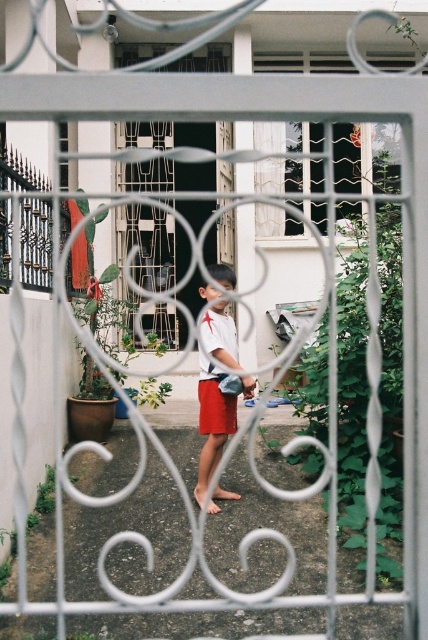
Question: Can you confirm if white matte shirt at center is thinner than red cotton shorts at center?

Choices:
 (A) no
 (B) yes

Answer: (A)

Question: From the image, what is the correct spatial relationship of white matte shirt at center in relation to red cotton shorts at center?

Choices:
 (A) right
 (B) left

Answer: (A)

Question: Which point appears closest to the camera in this image?

Choices:
 (A) (229, 282)
 (B) (211, 401)

Answer: (B)

Question: In this image, where is white matte shirt at center located relative to red cotton shorts at center?

Choices:
 (A) left
 (B) right

Answer: (B)

Question: Which point is closer to the camera?

Choices:
 (A) red cotton shorts at center
 (B) white matte shirt at center

Answer: (B)